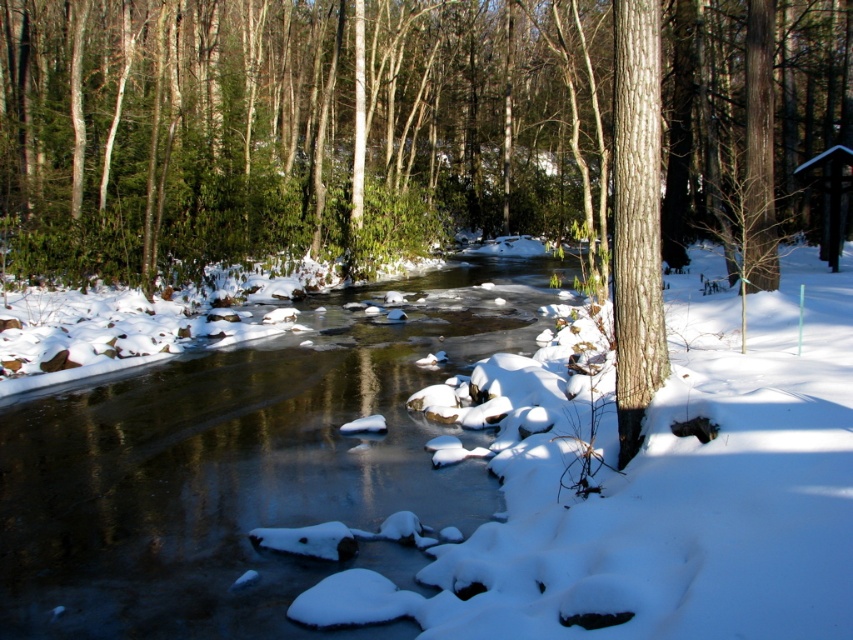
Question: Which point appears farthest from the camera in this image?

Choices:
 (A) (173, 381)
 (B) (663, 340)

Answer: (A)

Question: Is the position of clear ice stream at center less distant than that of smooth brown bark at right?

Choices:
 (A) yes
 (B) no

Answer: (A)

Question: Can you confirm if clear ice stream at center is positioned below smooth brown bark at right?

Choices:
 (A) no
 (B) yes

Answer: (B)

Question: Is clear ice stream at center positioned at the back of smooth brown bark at right?

Choices:
 (A) yes
 (B) no

Answer: (B)